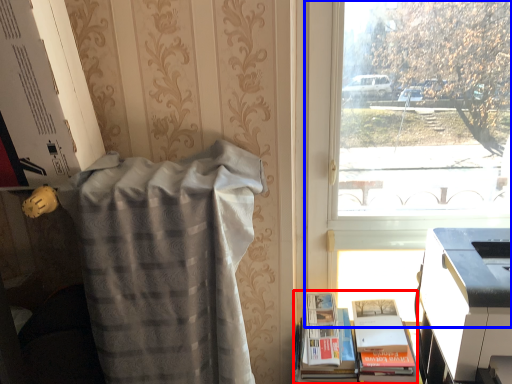
Question: Which object appears closest to the camera in this image, book (highlighted by a red box) or window (highlighted by a blue box)?

Choices:
 (A) book
 (B) window

Answer: (A)